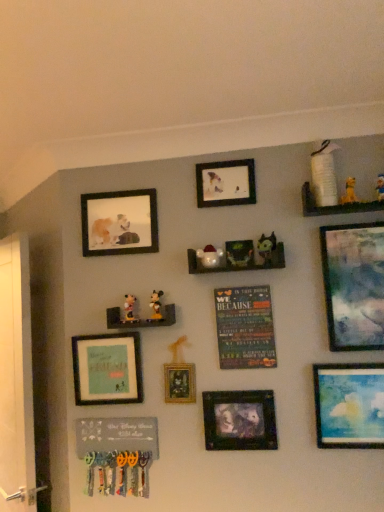
Question: Does matte plastic santa at center, which is counted as the 4th toy, starting from the right, turn towards matte wooden picture frame at upper left, positioned as the 2th picture frame in left-to-right order?

Choices:
 (A) no
 (B) yes

Answer: (A)

Question: Is matte plastic santa at center, which is counted as the 4th toy, starting from the right, wider than matte wooden picture frame at upper left, positioned as the 6th picture frame in right-to-left order?

Choices:
 (A) no
 (B) yes

Answer: (B)

Question: Does matte plastic santa at center, which ranks as the third toy in bottom-to-top order, have a greater height compared to matte wooden picture frame at upper left, positioned as the 2th picture frame in left-to-right order?

Choices:
 (A) no
 (B) yes

Answer: (A)

Question: From the image's perspective, is matte plastic santa at center, which appears as the 4th toy when viewed from the top, over matte wooden picture frame at upper left, positioned as the 6th picture frame in right-to-left order?

Choices:
 (A) yes
 (B) no

Answer: (B)

Question: Are matte plastic santa at center, which ranks as the third toy in bottom-to-top order, and matte wooden picture frame at upper left, positioned as the 6th picture frame in right-to-left order, far apart?

Choices:
 (A) no
 (B) yes

Answer: (A)

Question: Based on their positions, is white wooden screen door at left located to the left or right of matte black picture frame at upper center, the fourth picture frame from the left?

Choices:
 (A) right
 (B) left

Answer: (B)

Question: From a real-world perspective, is white wooden screen door at left positioned above or below matte black picture frame at upper center, arranged as the fourth picture frame when viewed from the right?

Choices:
 (A) above
 (B) below

Answer: (B)

Question: Is white wooden screen door at left inside or outside of matte black picture frame at upper center, the fourth picture frame from the left?

Choices:
 (A) outside
 (B) inside

Answer: (A)

Question: Is white wooden screen door at left wider or thinner than matte black picture frame at upper center, arranged as the fourth picture frame when viewed from the right?

Choices:
 (A) thin
 (B) wide

Answer: (B)

Question: Based on their sizes in the image, would you say matte green frame at center-left, which ranks as the 7th picture frame in right-to-left order, is bigger or smaller than gold metallic picture frame at center, marked as the 5th picture frame in a right-to-left arrangement?

Choices:
 (A) small
 (B) big

Answer: (B)

Question: Considering the relative positions of matte green frame at center-left, which ranks as the 7th picture frame in right-to-left order, and gold metallic picture frame at center, marked as the 5th picture frame in a right-to-left arrangement, in the image provided, is matte green frame at center-left, which ranks as the 7th picture frame in right-to-left order, to the left or to the right of gold metallic picture frame at center, marked as the 5th picture frame in a right-to-left arrangement,?

Choices:
 (A) left
 (B) right

Answer: (A)

Question: In terms of width, does matte green frame at center-left, which ranks as the 7th picture frame in right-to-left order, look wider or thinner when compared to gold metallic picture frame at center, marked as the 5th picture frame in a right-to-left arrangement?

Choices:
 (A) thin
 (B) wide

Answer: (B)

Question: From the image's perspective, is matte green frame at center-left, which is the 1th picture frame in left-to-right order, above or below gold metallic picture frame at center, marked as the 5th picture frame in a right-to-left arrangement?

Choices:
 (A) above
 (B) below

Answer: (A)

Question: Is matte glass painting at upper right, acting as the 1th picture frame starting from the right, inside the boundaries of matte blue painting at lower right, marked as the sixth picture frame in a left-to-right arrangement, or outside?

Choices:
 (A) outside
 (B) inside

Answer: (A)

Question: From the image's perspective, is matte glass painting at upper right, arranged as the 7th picture frame when viewed from the left, above or below matte blue painting at lower right, which is the second picture frame in right-to-left order?

Choices:
 (A) below
 (B) above

Answer: (B)